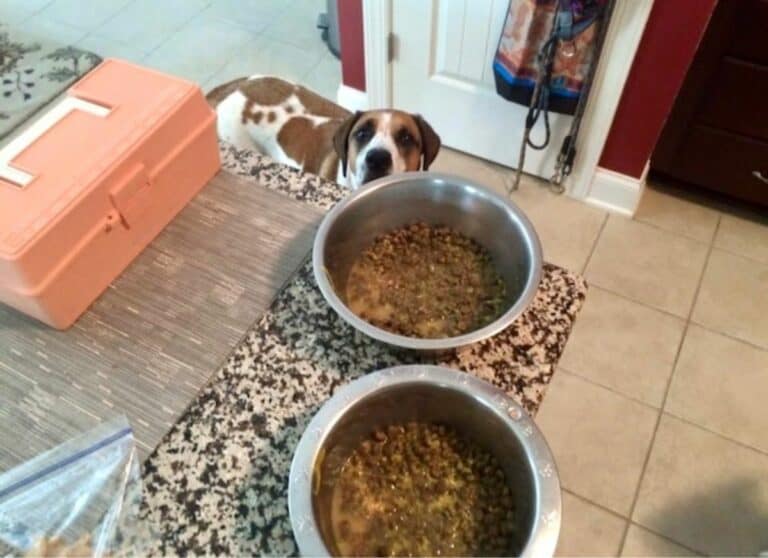
Identify the location of tiled tan floor. (636, 362).